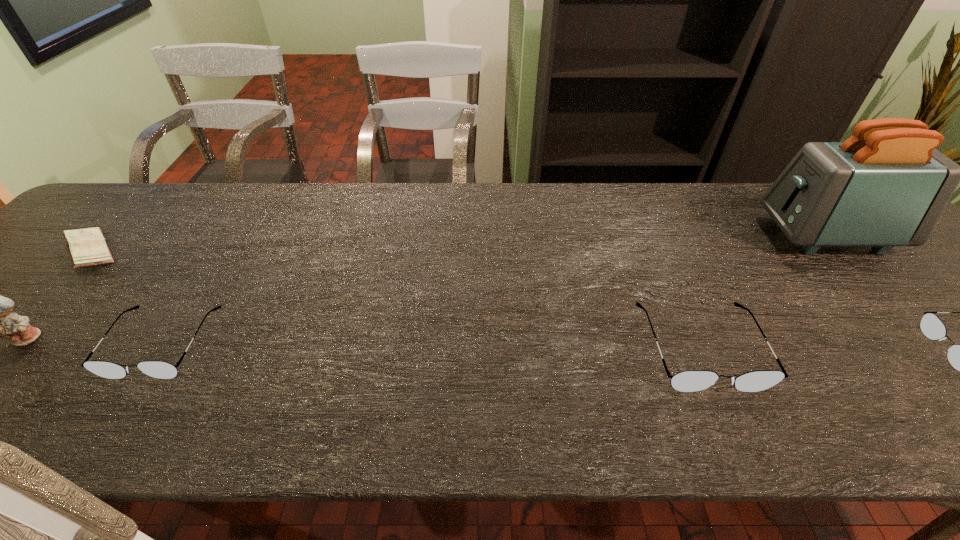
You are a GUI agent. You are given a task and a screenshot of the screen. Output one action in this format:
    pyautogui.click(x=<x>, y=<y>)
    Task: Click on the vacant space at the right edge
    
    Given the screenshot: What is the action you would take?
    pyautogui.click(x=946, y=299)

Image resolution: width=960 pixels, height=540 pixels. What are the coordinates of `free area in between the tallest spectacles and the diary` in the screenshot? It's located at tap(396, 300).

The image size is (960, 540). Find the location of `free space between the fifth shortest object and the third tallest object`. free space between the fifth shortest object and the third tallest object is located at coordinates (364, 343).

Locate an element on the screen. free space between the fourth object from right to left and the diary is located at coordinates (128, 298).

The width and height of the screenshot is (960, 540). What are the coordinates of `vacant area that lies between the diary and the toaster` in the screenshot? It's located at (459, 244).

Find the location of a particular element. unoccupied area between the second spectacles from left to right and the diary is located at coordinates (396, 300).

At what (x,y) coordinates should I click in order to perform the action: click on empty space between the tallest object and the second tallest object. Please return your answer as a coordinate pair (x, y). This screenshot has width=960, height=540. Looking at the image, I should click on (428, 286).

Identify which object is located as the second nearest to the second spectacles from right to left. Please provide its 2D coordinates. Your answer should be formatted as a tuple, i.e. [(x, y)], where the tuple contains the x and y coordinates of a point satisfying the conditions above.

[(959, 356)]

Image resolution: width=960 pixels, height=540 pixels. Identify the location of the fourth closest object to the toaster. click(87, 247).

Find the location of a particular element. spectacles that can be found as the third closest to the diary is located at coordinates (959, 356).